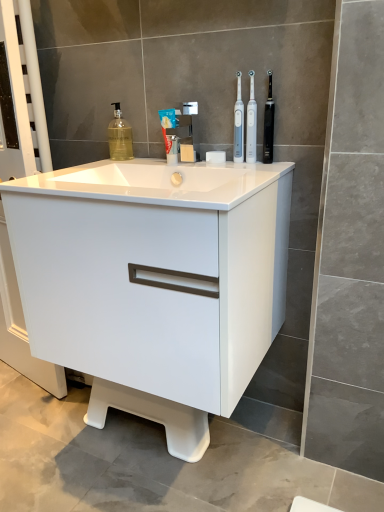
Find the location of `free space between white plastic toothbrush at upper center, acting as the 2th toothbrush starting from the right, and chrome metallic faucet at upper center`. free space between white plastic toothbrush at upper center, acting as the 2th toothbrush starting from the right, and chrome metallic faucet at upper center is located at coordinates (213, 166).